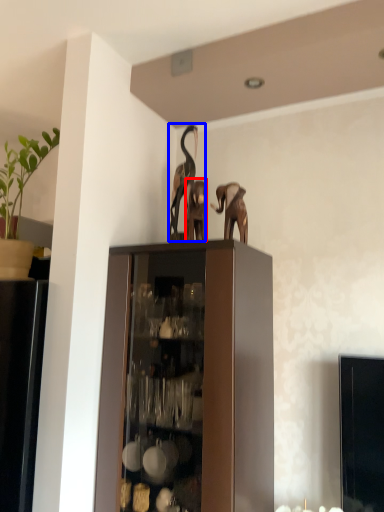
Question: Which of the following is the closest to the observer, animal (highlighted by a red box) or animal (highlighted by a blue box)?

Choices:
 (A) animal
 (B) animal

Answer: (A)